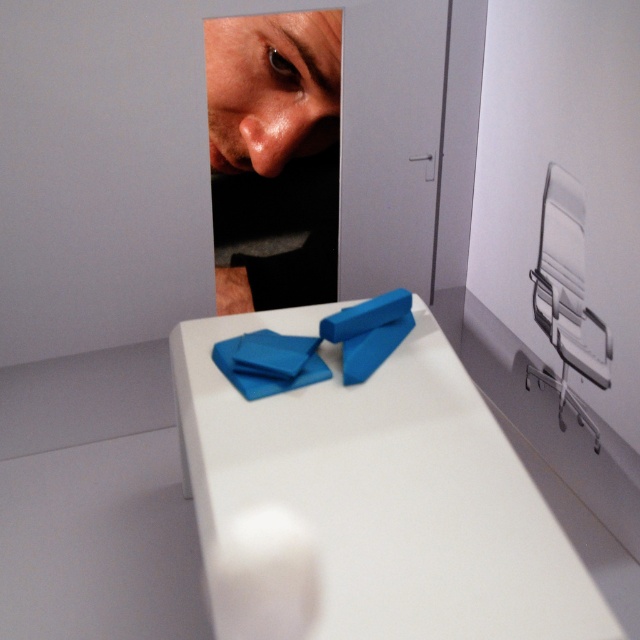
You are standing in front of a table and want to place a small object exactly at the center of the white glossy table at center. According to the coordinates provided, where should you place the object?

The center of the white glossy table at center is located at coordinates point (369, 500), so you should place the object there.